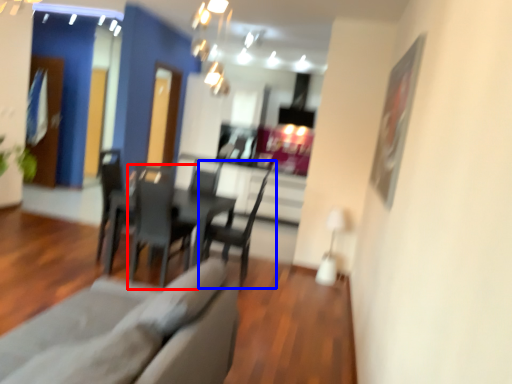
Question: Which of the following is the closest to the observer, chair (highlighted by a red box) or chair (highlighted by a blue box)?

Choices:
 (A) chair
 (B) chair

Answer: (A)